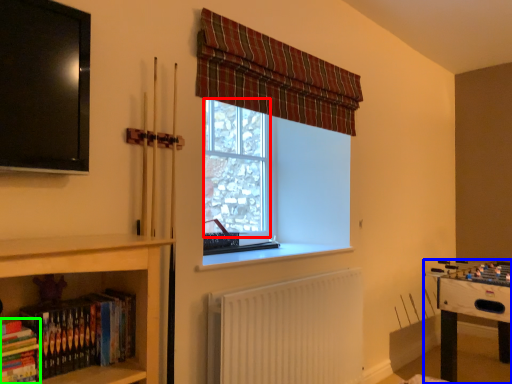
Question: Which object is the closest to the bay window (highlighted by a red box)? Choose among these: table (highlighted by a blue box) or book (highlighted by a green box).

Choices:
 (A) table
 (B) book

Answer: (A)